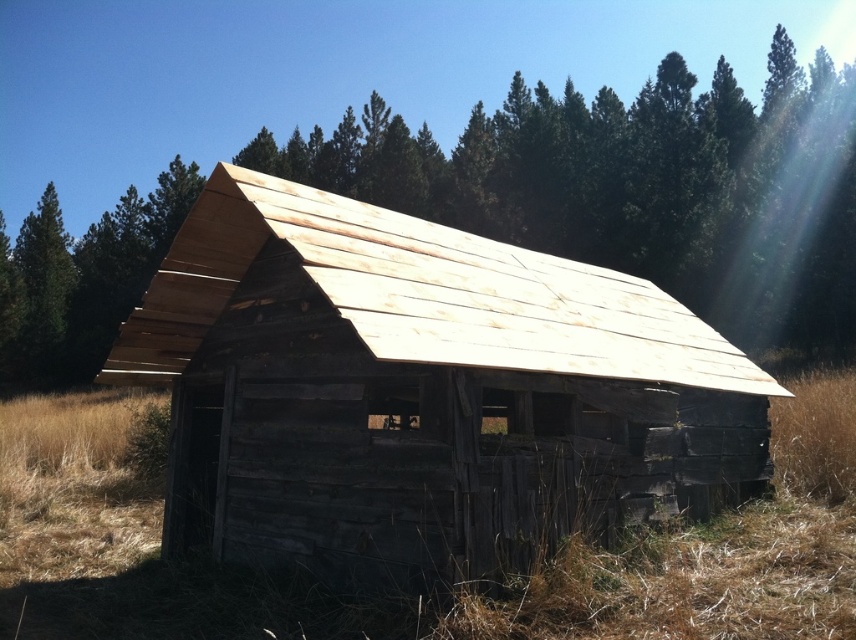
You are standing 10 meters away from the weathered wood barn at center. You want to throw a ball to hit the brown wooden roof at center. Can you reach it with a throw?

The distance between the weathered wood barn at center and the brown wooden roof at center is 45.72 meters. Since you are already 10 meters away from the barn, the total distance to the roof would be 55.72 meters. A typical human throw cannot reach that far, so you cannot hit the roof with a throw.

You are standing in front of the weathered wood barn at center and the brown wooden roof at center. Which one is positioned lower in the image?

The weathered wood barn at center is positioned lower than the brown wooden roof at center.